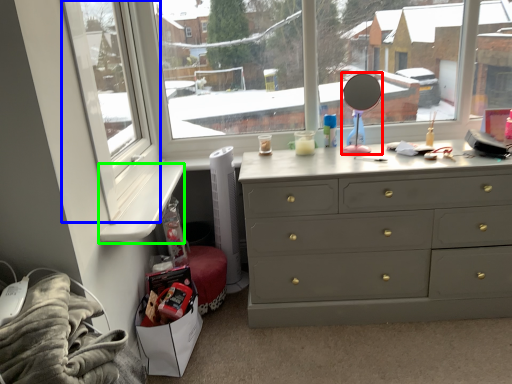
Question: Based on their relative distances, which object is nearer to mirror (highlighted by a red box)? Choose from window frame (highlighted by a blue box) and window sill (highlighted by a green box).

Choices:
 (A) window frame
 (B) window sill

Answer: (B)